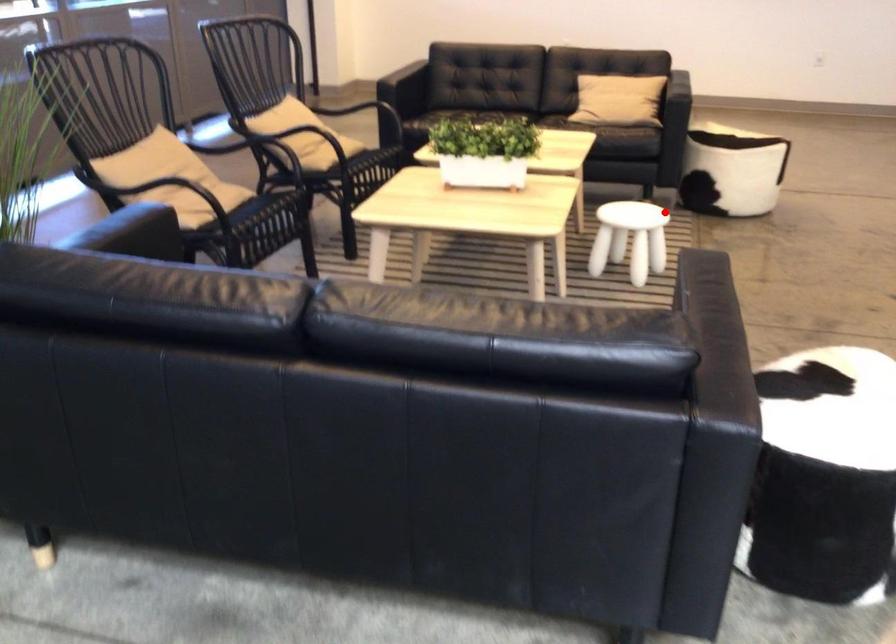
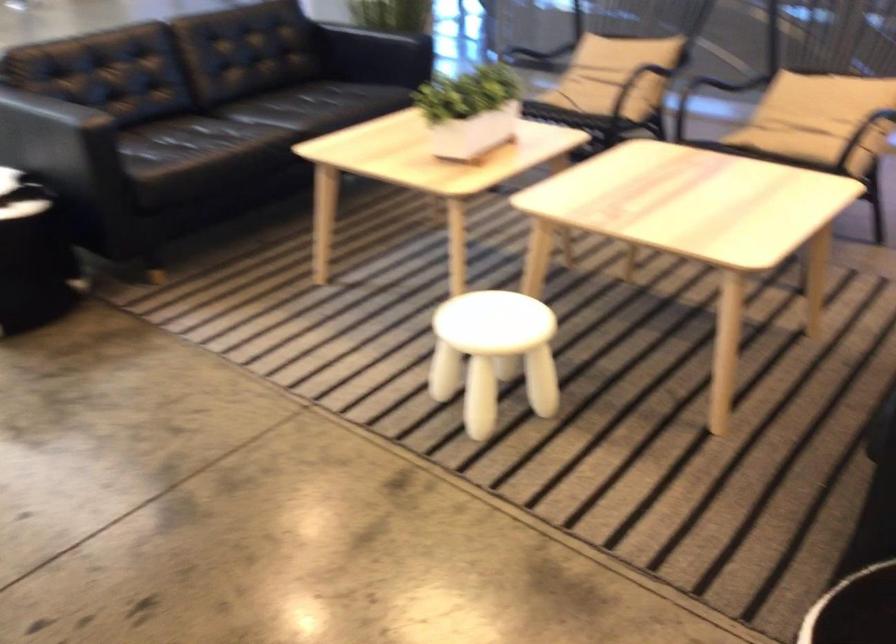
Locate, in the second image, the point that corresponds to the highlighted location in the first image.

(493, 354)